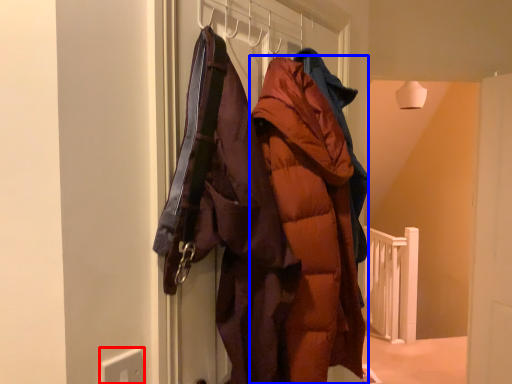
Question: Among these objects, which one is nearest to the camera, electric outlet (highlighted by a red box) or coat (highlighted by a blue box)?

Choices:
 (A) electric outlet
 (B) coat

Answer: (A)